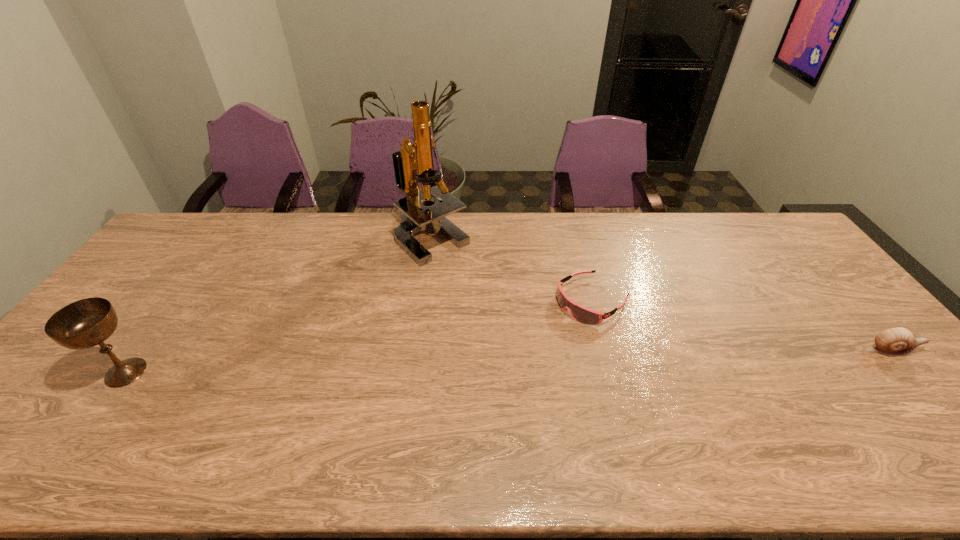
Where is `free space that satisfies the following two spatial constraints: 1. on the back side of the rightmost object; 2. on the front-facing side of the leftmost object`? The image size is (960, 540). free space that satisfies the following two spatial constraints: 1. on the back side of the rightmost object; 2. on the front-facing side of the leftmost object is located at coordinates (141, 350).